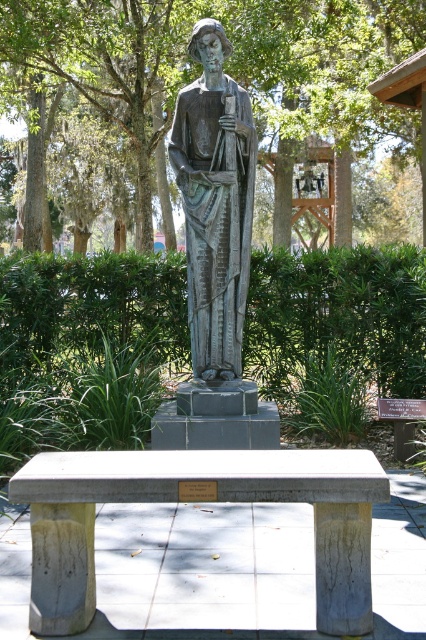
Question: Is gray concrete bench at center to the left of bronze statue at center from the viewer's perspective?

Choices:
 (A) no
 (B) yes

Answer: (B)

Question: Among these objects, which one is farthest from the camera?

Choices:
 (A) gray concrete bench at center
 (B) bronze statue at center

Answer: (B)

Question: Does gray concrete bench at center appear on the left side of bronze statue at center?

Choices:
 (A) no
 (B) yes

Answer: (B)

Question: Considering the relative positions of gray concrete bench at center and bronze statue at center in the image provided, where is gray concrete bench at center located with respect to bronze statue at center?

Choices:
 (A) above
 (B) below

Answer: (B)